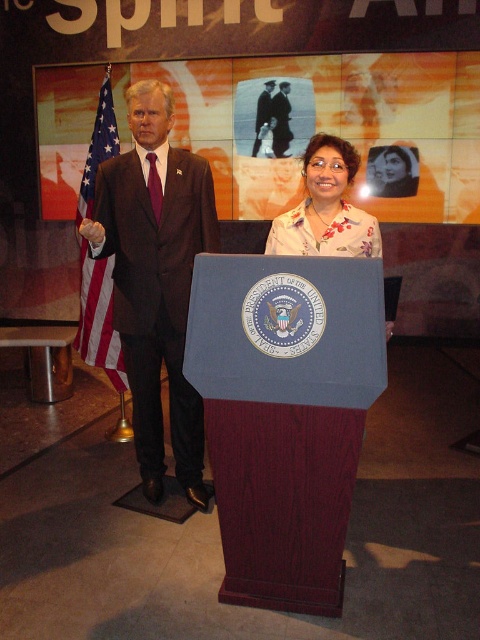
Can you confirm if red-white-blue fabric flag at left is positioned above dark suit at center?

Actually, red-white-blue fabric flag at left is below dark suit at center.

In the scene shown: Does red-white-blue fabric flag at left appear on the right side of dark suit at center?

Incorrect, red-white-blue fabric flag at left is not on the right side of dark suit at center.

Locate an element on the screen. This screenshot has height=640, width=480. red-white-blue fabric flag at left is located at coordinates (98, 317).

Is matte brown suit at left smaller than dark blue suit at center?

Actually, matte brown suit at left might be larger than dark blue suit at center.

Can you confirm if matte brown suit at left is shorter than dark blue suit at center?

In fact, matte brown suit at left may be taller than dark blue suit at center.

Who is more distant from viewer, (x=136, y=92) or (x=275, y=150)?

The point (x=275, y=150) is more distant.

The width and height of the screenshot is (480, 640). Identify the location of matte brown suit at left. (156, 278).

Who is shorter, red-white-blue fabric flag at left or dark blue suit at center?

Standing shorter between the two is dark blue suit at center.

Which is in front, point (85, 346) or point (282, 150)?

Positioned in front is point (85, 346).

Is point (88, 268) farther from camera compared to point (282, 124)?

No.

The width and height of the screenshot is (480, 640). I want to click on red-white-blue fabric flag at left, so click(x=98, y=317).